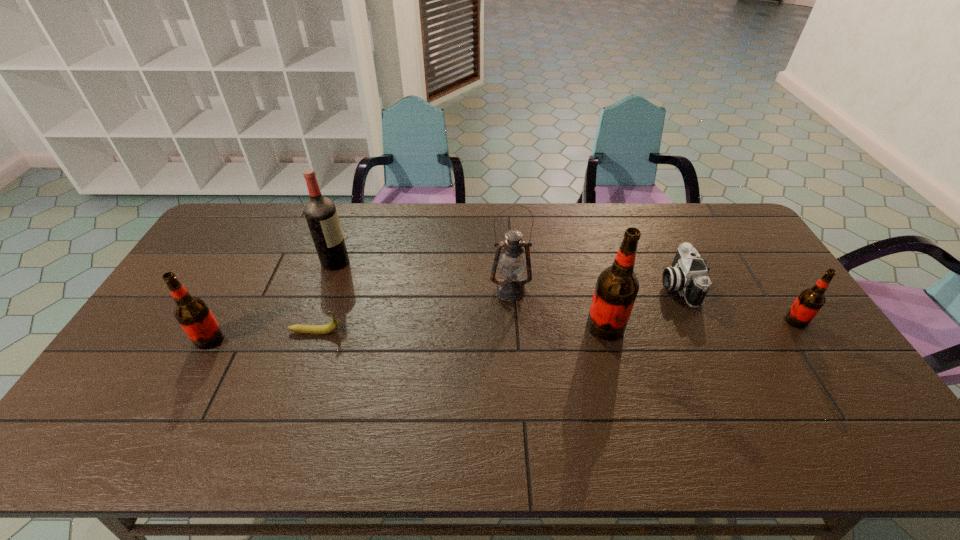
Locate an element on the screen. The height and width of the screenshot is (540, 960). free spot between the third shortest object and the fourth shortest object is located at coordinates (503, 330).

Identify the location of free space between the tallest root beer and the liquor. The image size is (960, 540). (470, 294).

The width and height of the screenshot is (960, 540). Find the location of `blank region between the sixth tallest object and the fourth object from left to right`. blank region between the sixth tallest object and the fourth object from left to right is located at coordinates (594, 288).

This screenshot has height=540, width=960. What are the coordinates of `free space between the fourth object from right to left and the sixth object from left to right` in the screenshot? It's located at (594, 288).

Point out which object is positioned as the fifth nearest to the leftmost object. Please provide its 2D coordinates. Your answer should be formatted as a tuple, i.e. [(x, y)], where the tuple contains the x and y coordinates of a point satisfying the conditions above.

[(688, 275)]

You are a GUI agent. You are given a task and a screenshot of the screen. Output one action in this format:
    pyautogui.click(x=<x>, y=<y>)
    Task: Click on the object that is the fourth closest one to the second shortest object
    The image size is (960, 540).
    Given the screenshot: What is the action you would take?
    pyautogui.click(x=332, y=326)

Where is `root beer that stands as the second closest to the third shortest object`? root beer that stands as the second closest to the third shortest object is located at coordinates (192, 313).

Find the location of a particular element. The height and width of the screenshot is (540, 960). the third closest root beer to the liquor is located at coordinates (809, 302).

Locate an element on the screen. The width and height of the screenshot is (960, 540). vacant space that satisfies the following two spatial constraints: 1. on the front side of the camera; 2. at the stem of the shortest object is located at coordinates (700, 332).

Find the location of `vacant space that satisfies the following two spatial constraints: 1. on the back side of the second root beer from right to left; 2. on the left side of the fourth tallest object`. vacant space that satisfies the following two spatial constraints: 1. on the back side of the second root beer from right to left; 2. on the left side of the fourth tallest object is located at coordinates (217, 327).